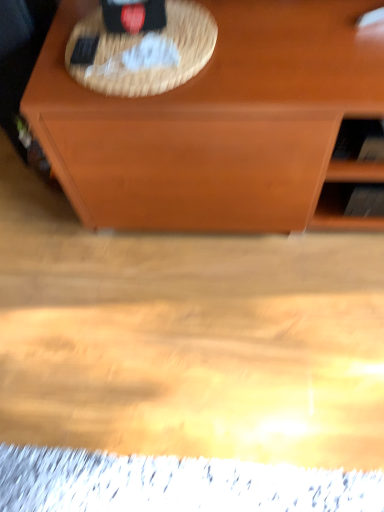
Describe the element at coordinates (354, 179) in the screenshot. Image resolution: width=384 pixels, height=512 pixels. I see `wooden shelf at right` at that location.

Locate an element on the screen. Image resolution: width=384 pixels, height=512 pixels. wooden shelf at right is located at coordinates (354, 179).

This screenshot has height=512, width=384. Find the location of `woven straw picnic basket at upper center`. woven straw picnic basket at upper center is located at coordinates (142, 52).

The height and width of the screenshot is (512, 384). What do you see at coordinates (142, 52) in the screenshot?
I see `woven straw picnic basket at upper center` at bounding box center [142, 52].

Identify the location of wooden shelf at right. This screenshot has width=384, height=512. (354, 179).

Visually, is woven straw picnic basket at upper center positioned to the left or to the right of wooden shelf at right?

woven straw picnic basket at upper center is to the left of wooden shelf at right.

Does woven straw picnic basket at upper center come behind wooden shelf at right?

No, woven straw picnic basket at upper center is in front of wooden shelf at right.

Considering the positions of point (184, 65) and point (366, 147), is point (184, 65) closer or farther from the camera than point (366, 147)?

Point (184, 65) is closer to the camera than point (366, 147).

From the image's perspective, which object appears higher, woven straw picnic basket at upper center or wooden shelf at right?

woven straw picnic basket at upper center is shown above in the image.

Consider the image. From a real-world perspective, who is located lower, woven straw picnic basket at upper center or wooden shelf at right?

In real-world perspective, wooden shelf at right is lower.

Is woven straw picnic basket at upper center thinner than wooden shelf at right?

Incorrect, the width of woven straw picnic basket at upper center is not less than that of wooden shelf at right.

Consider the image. In terms of height, does woven straw picnic basket at upper center look taller or shorter compared to wooden shelf at right?

Considering their sizes, woven straw picnic basket at upper center has less height than wooden shelf at right.

Considering the sizes of woven straw picnic basket at upper center and wooden shelf at right in the image, is woven straw picnic basket at upper center bigger or smaller than wooden shelf at right?

Considering their sizes, woven straw picnic basket at upper center takes up less space than wooden shelf at right.

Which is correct: woven straw picnic basket at upper center is inside wooden shelf at right, or outside of it?

woven straw picnic basket at upper center cannot be found inside wooden shelf at right.

Is woven straw picnic basket at upper center next to wooden shelf at right?

No, woven straw picnic basket at upper center is not next to wooden shelf at right.

Is woven straw picnic basket at upper center oriented towards wooden shelf at right?

No.

How far apart are woven straw picnic basket at upper center and wooden shelf at right?

They are 21.38 inches apart.

You are a GUI agent. You are given a task and a screenshot of the screen. Output one action in this format:
    pyautogui.click(x=<x>, y=<y>)
    Task: Click on the shelf below the woven straw picnic basket at upper center (from a real-world perspective)
    This screenshot has height=512, width=384.
    Given the screenshot: What is the action you would take?
    pyautogui.click(x=354, y=179)

Which is more to the right, wooden shelf at right or woven straw picnic basket at upper center?

Positioned to the right is wooden shelf at right.

Is wooden shelf at right positioned behind woven straw picnic basket at upper center?

Yes, it is.

Is point (373, 169) positioned before point (116, 60)?

No, (373, 169) is behind (116, 60).

From the picture: From the image's perspective, is wooden shelf at right located above woven straw picnic basket at upper center?

No, from the image's perspective, wooden shelf at right is not on top of woven straw picnic basket at upper center.

From a real-world perspective, is wooden shelf at right under woven straw picnic basket at upper center?

Yes, from a real-world perspective, wooden shelf at right is under woven straw picnic basket at upper center.

Looking at their sizes, would you say wooden shelf at right is wider or thinner than woven straw picnic basket at upper center?

In the image, wooden shelf at right appears to be more narrow than woven straw picnic basket at upper center.

Considering the sizes of objects wooden shelf at right and woven straw picnic basket at upper center in the image provided, who is shorter, wooden shelf at right or woven straw picnic basket at upper center?

woven straw picnic basket at upper center is shorter.

Does wooden shelf at right have a smaller size compared to woven straw picnic basket at upper center?

No.

Is woven straw picnic basket at upper center surrounded by wooden shelf at right?

No, woven straw picnic basket at upper center is not surrounded by wooden shelf at right.

Is wooden shelf at right far away from woven straw picnic basket at upper center?

No, there isn't a large distance between wooden shelf at right and woven straw picnic basket at upper center.

Does wooden shelf at right turn towards woven straw picnic basket at upper center?

No.

How different are the orientations of wooden shelf at right and woven straw picnic basket at upper center in degrees?

There is a 0.931-degree angle between the facing directions of wooden shelf at right and woven straw picnic basket at upper center.

From the picture: Measure the distance from wooden shelf at right to woven straw picnic basket at upper center.

wooden shelf at right and woven straw picnic basket at upper center are 21.38 inches apart.

The width and height of the screenshot is (384, 512). Find the location of `picnic basket located above the wooden shelf at right (from the image's perspective)`. picnic basket located above the wooden shelf at right (from the image's perspective) is located at coordinates (142, 52).

Find the location of a particular element. picnic basket that appears above the wooden shelf at right (from a real-world perspective) is located at coordinates (142, 52).

Identify the location of shelf lying behind the woven straw picnic basket at upper center. (354, 179).